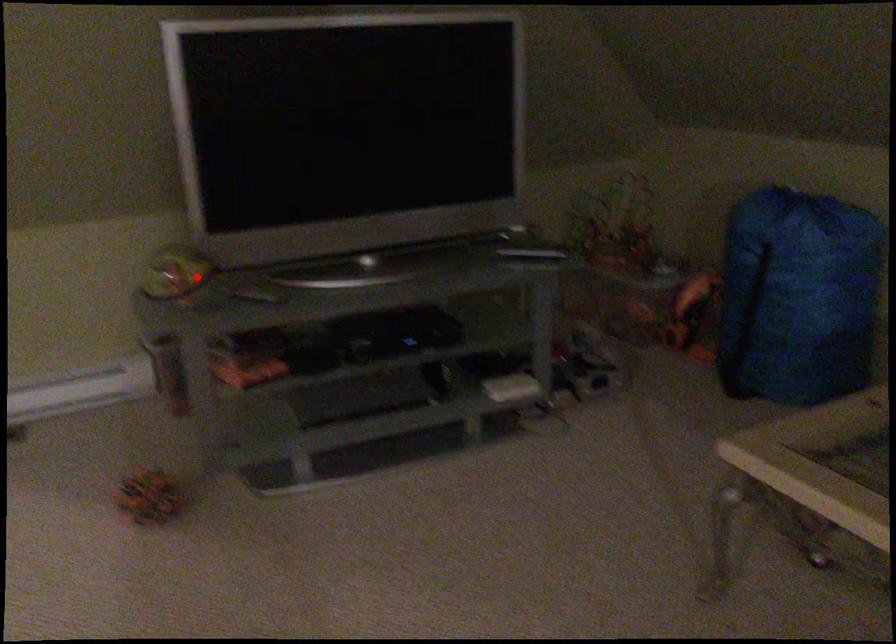
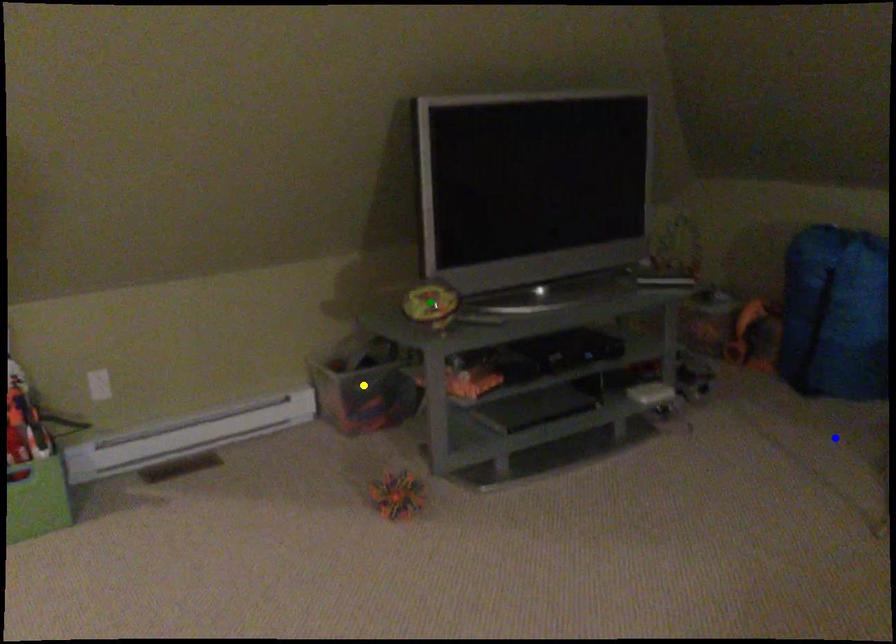
Question: I am providing you with two images of the same scene from different viewpoints. A red point is marked on the first image. You are given multiple points on the second image. Which point in image 2 represents the same 3d spot as the red point in image 1?

Choices:
 (A) blue point
 (B) green point
 (C) yellow point

Answer: (B)